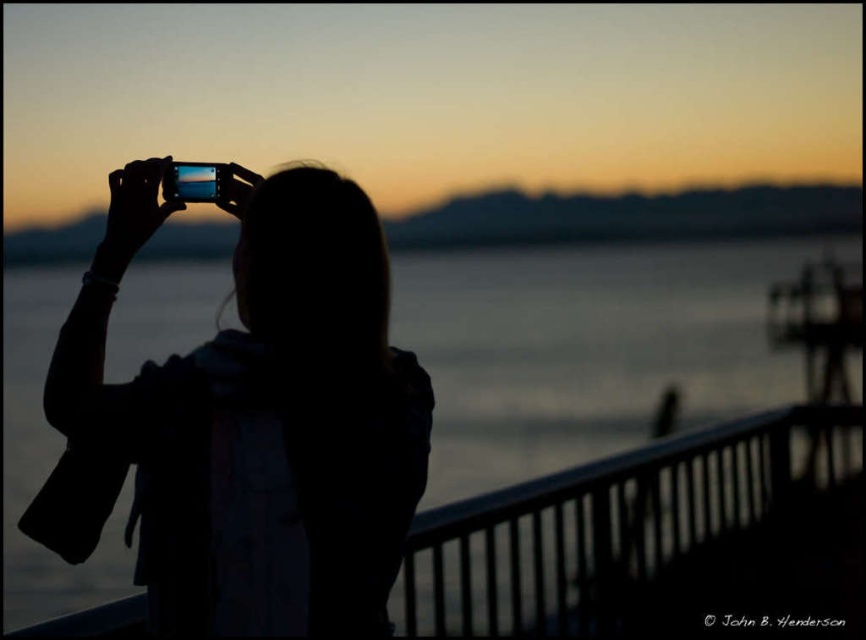
You are a photographer trying to capture the reflection of the sunset on the transparent water at center. You notice the silhouette hair at center is blocking part of the view. Which object should you move closer to the camera to ensure the reflection remains visible?

You should move the silhouette hair at center closer to the camera since it is already closer than the transparent water at center, allowing you to adjust its position without obstructing the distant water reflection.

You are a photographer trying to capture the reflection of the sunset in the water. You notice the silhouette hair at center and transparent water at center in your frame. Which object is closer to the right edge of your camera view?

The silhouette hair at center is positioned on the right side of transparent water at center, so it is closer to the right edge of your camera view.

You are a photographer trying to capture the silhouette hair at center and the transparent water at center in a single frame. Based on their widths, which object should you focus on to ensure both fit in the photo?

The silhouette hair at center has a lesser width compared to transparent water at center, so you should focus on the silhouette hair at center to ensure both fit in the photo.